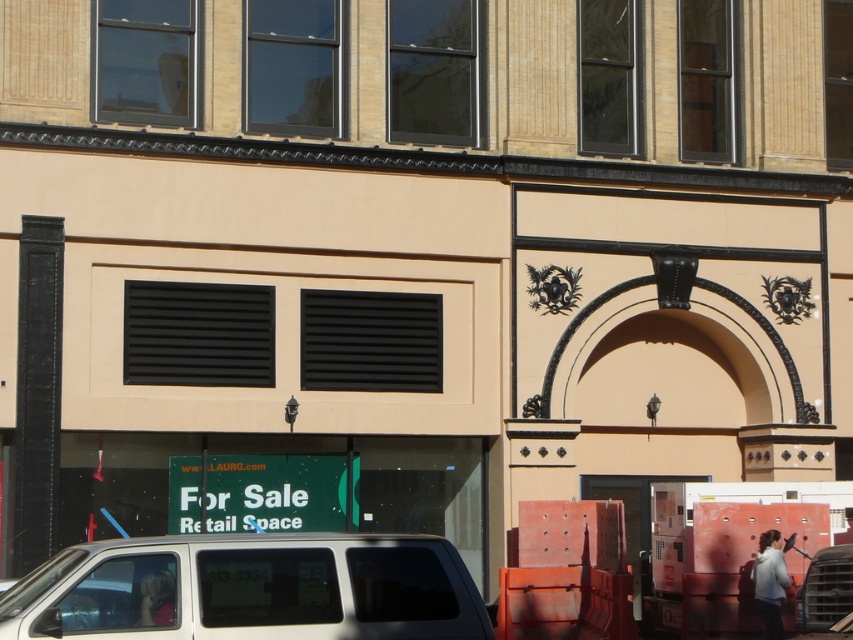
Is white matte van at lower left below white hoodie at lower right?

No.

Does white matte van at lower left appear on the right side of white hoodie at lower right?

No, white matte van at lower left is not to the right of white hoodie at lower right.

Between point (221, 545) and point (770, 531), which one is positioned behind?

Positioned behind is point (770, 531).

The width and height of the screenshot is (853, 640). I want to click on white matte van at lower left, so click(x=254, y=588).

Does white matte van at lower left have a greater height compared to blonde hair at lower left?

Yes, white matte van at lower left is taller than blonde hair at lower left.

Does white matte van at lower left have a lesser height compared to blonde hair at lower left?

In fact, white matte van at lower left may be taller than blonde hair at lower left.

Is point (367, 570) closer to viewer compared to point (151, 614)?

No, (367, 570) is behind (151, 614).

You are a GUI agent. You are given a task and a screenshot of the screen. Output one action in this format:
    pyautogui.click(x=<x>, y=<y>)
    Task: Click on the white matte van at lower left
    The width and height of the screenshot is (853, 640).
    Given the screenshot: What is the action you would take?
    pyautogui.click(x=254, y=588)

Does white hoodie at lower right have a larger size compared to blonde hair at lower left?

Yes.

Is white hoodie at lower right taller than blonde hair at lower left?

Yes.

This screenshot has height=640, width=853. What do you see at coordinates (769, 582) in the screenshot? I see `white hoodie at lower right` at bounding box center [769, 582].

Image resolution: width=853 pixels, height=640 pixels. In order to click on white hoodie at lower right in this screenshot , I will do `click(769, 582)`.